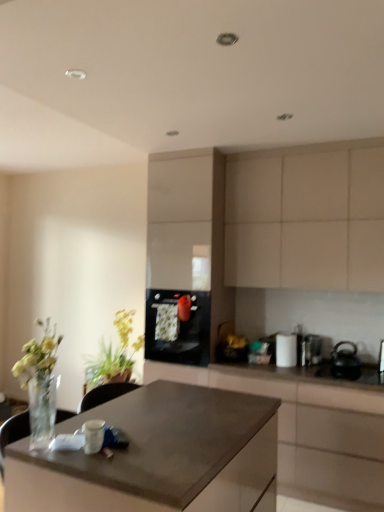
Question: Is white glossy canister at upper right, which appears as the first appliance when viewed from the left, facing away from black glossy sink at lower right?

Choices:
 (A) yes
 (B) no

Answer: (B)

Question: Is white glossy canister at upper right, which is counted as the third appliance, starting from the right, next to black glossy sink at lower right and touching it?

Choices:
 (A) no
 (B) yes

Answer: (A)

Question: Does white glossy canister at upper right, which is counted as the third appliance, starting from the right, appear on the left side of black glossy sink at lower right?

Choices:
 (A) yes
 (B) no

Answer: (A)

Question: Is the position of white glossy canister at upper right, which appears as the first appliance when viewed from the left, more distant than that of black glossy sink at lower right?

Choices:
 (A) yes
 (B) no

Answer: (A)

Question: Is white glossy canister at upper right, which is counted as the third appliance, starting from the right, positioned beyond the bounds of black glossy sink at lower right?

Choices:
 (A) yes
 (B) no

Answer: (A)

Question: Is white glossy canister at upper right, which appears as the first appliance when viewed from the left, not close to black glossy sink at lower right?

Choices:
 (A) no
 (B) yes

Answer: (A)

Question: Can you confirm if black glossy sink at lower right is shorter than green leafy plant at left?

Choices:
 (A) yes
 (B) no

Answer: (A)

Question: Is black glossy sink at lower right thinner than green leafy plant at left?

Choices:
 (A) no
 (B) yes

Answer: (A)

Question: Does black glossy sink at lower right have a greater height compared to green leafy plant at left?

Choices:
 (A) yes
 (B) no

Answer: (B)

Question: Is black glossy sink at lower right not within green leafy plant at left?

Choices:
 (A) yes
 (B) no

Answer: (A)

Question: From the image's perspective, is black glossy sink at lower right over green leafy plant at left?

Choices:
 (A) no
 (B) yes

Answer: (B)

Question: Is black glossy sink at lower right not near green leafy plant at left?

Choices:
 (A) no
 (B) yes

Answer: (B)

Question: From a real-world perspective, is white glossy canister at upper right, which is counted as the third appliance, starting from the right, positioned over matte brown desk at center based on gravity?

Choices:
 (A) no
 (B) yes

Answer: (B)